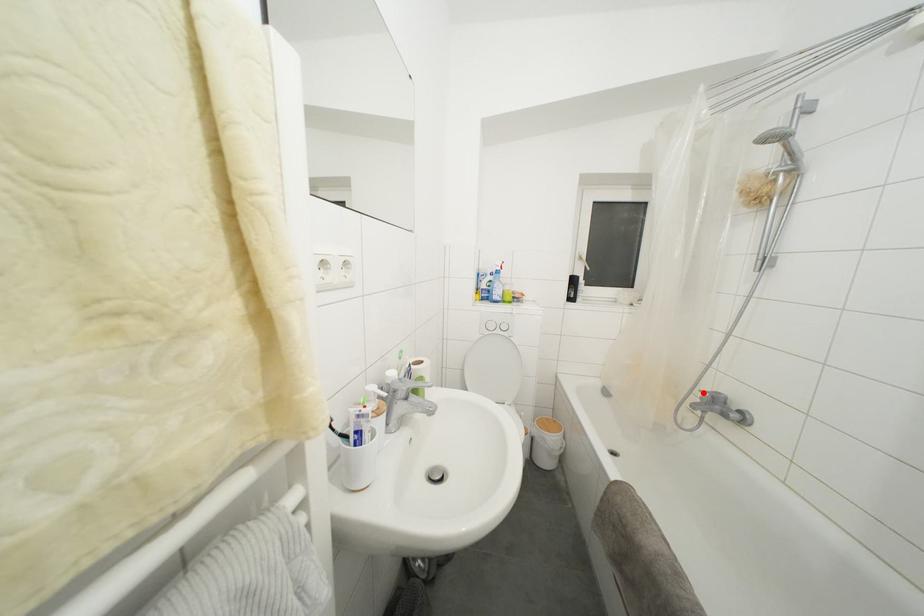
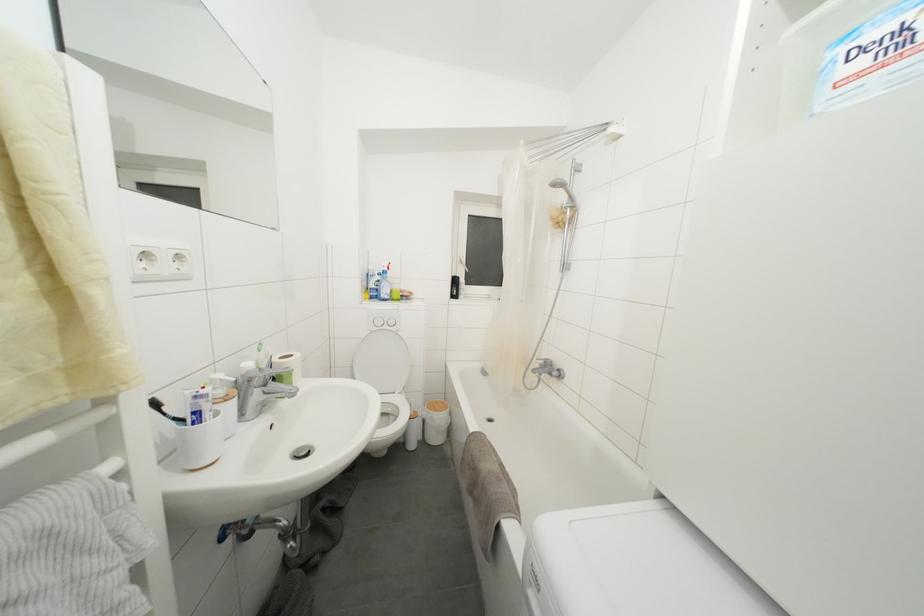
In the second image, find the point that corresponds to the highlighted location in the first image.

(540, 362)